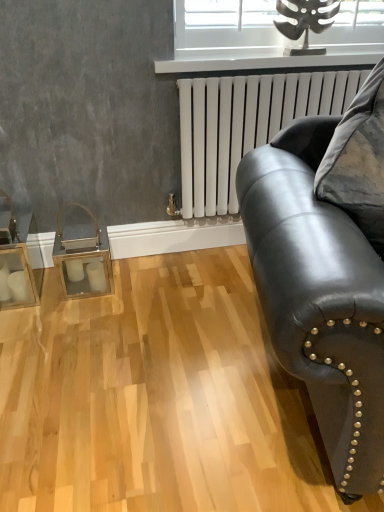
Locate an element on the screen. The width and height of the screenshot is (384, 512). free space above white matte radiator at upper right (from a real-world perspective) is located at coordinates (280, 73).